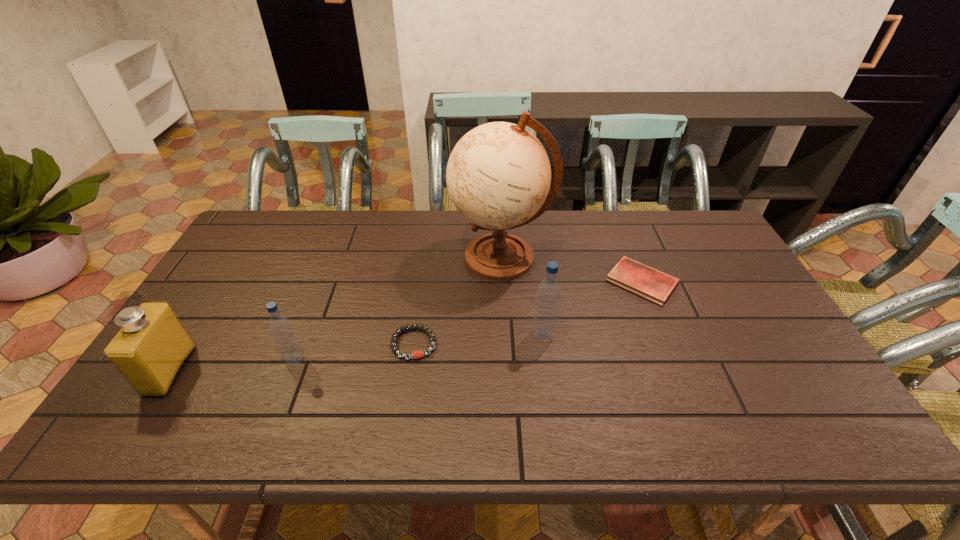
You are a GUI agent. You are given a task and a screenshot of the screen. Output one action in this format:
    pyautogui.click(x=<x>, y=<y>)
    Task: Click on the vacant region between the perfume and the tallest object
    This screenshot has width=960, height=540.
    Given the screenshot: What is the action you would take?
    coord(336,314)

At what (x,y) coordinates should I click in order to perform the action: click on free space between the rightmost object and the farther water bottle. Please return your answer as a coordinate pair (x, y). The image size is (960, 540). Looking at the image, I should click on (592, 308).

Locate an element on the screen. The height and width of the screenshot is (540, 960). vacant space that's between the farther water bottle and the shortest object is located at coordinates (592, 308).

Find the location of `free space between the taller water bottle and the third object from left to right`. free space between the taller water bottle and the third object from left to right is located at coordinates (478, 340).

You are a GUI agent. You are given a task and a screenshot of the screen. Output one action in this format:
    pyautogui.click(x=<x>, y=<y>)
    Task: Click on the second closest object to the diary
    
    Given the screenshot: What is the action you would take?
    pyautogui.click(x=548, y=296)

Choose which object is the third nearest neighbor to the perfume. Please provide its 2D coordinates. Your answer should be formatted as a tuple, i.e. [(x, y)], where the tuple contains the x and y coordinates of a point satisfying the conditions above.

[(498, 176)]

Locate an element on the screen. The image size is (960, 540). vacant area that satisfies the following two spatial constraints: 1. on the surface of the rightmost object; 2. on the right side of the globe is located at coordinates (502, 282).

The width and height of the screenshot is (960, 540). I want to click on free space that satisfies the following two spatial constraints: 1. on the back side of the bracelet; 2. on the right side of the right water bottle, so click(x=415, y=335).

I want to click on blank area in the image that satisfies the following two spatial constraints: 1. on the surface of the taller water bottle; 2. on the left side of the globe, so click(506, 335).